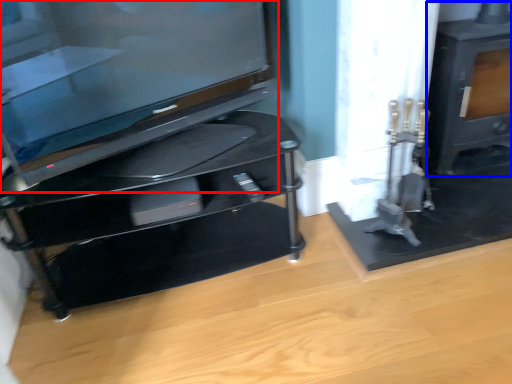
Question: Which object appears farthest to the camera in this image, television (highlighted by a red box) or stove (highlighted by a blue box)?

Choices:
 (A) television
 (B) stove

Answer: (B)